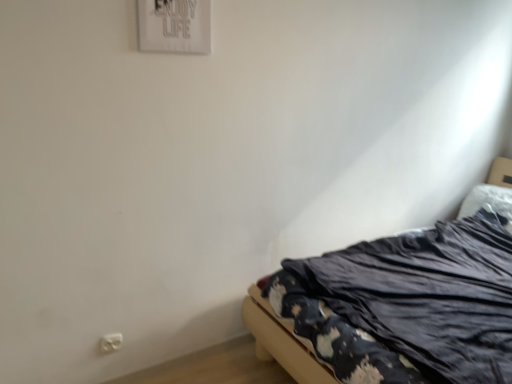
Question: From the image's perspective, is white plastic electric outlet at lower left located beneath dark fabric bed at lower right?

Choices:
 (A) yes
 (B) no

Answer: (A)

Question: Is white plastic electric outlet at lower left placed right next to dark fabric bed at lower right?

Choices:
 (A) no
 (B) yes

Answer: (A)

Question: Does white plastic electric outlet at lower left have a larger size compared to dark fabric bed at lower right?

Choices:
 (A) yes
 (B) no

Answer: (B)

Question: Does white plastic electric outlet at lower left have a greater width compared to dark fabric bed at lower right?

Choices:
 (A) no
 (B) yes

Answer: (A)

Question: Is white plastic electric outlet at lower left facing towards dark fabric bed at lower right?

Choices:
 (A) yes
 (B) no

Answer: (B)

Question: From a real-world perspective, is white plastic electric outlet at lower left on top of dark fabric bed at lower right?

Choices:
 (A) yes
 (B) no

Answer: (B)

Question: Is dark fabric bed at lower right positioned far away from white plastic electric outlet at lower left?

Choices:
 (A) yes
 (B) no

Answer: (A)

Question: Can you confirm if dark fabric bed at lower right is bigger than white plastic electric outlet at lower left?

Choices:
 (A) yes
 (B) no

Answer: (A)

Question: From the image's perspective, would you say dark fabric bed at lower right is shown under white plastic electric outlet at lower left?

Choices:
 (A) no
 (B) yes

Answer: (A)

Question: Can you confirm if dark fabric bed at lower right is positioned to the left of white plastic electric outlet at lower left?

Choices:
 (A) yes
 (B) no

Answer: (B)

Question: Is dark fabric bed at lower right wider than white plastic electric outlet at lower left?

Choices:
 (A) yes
 (B) no

Answer: (A)

Question: Could white plastic electric outlet at lower left be considered to be inside dark fabric bed at lower right?

Choices:
 (A) yes
 (B) no

Answer: (B)

Question: Considering the relative positions of white plastic electric outlet at lower left and dark fabric bed at lower right in the image provided, is white plastic electric outlet at lower left to the left or to the right of dark fabric bed at lower right?

Choices:
 (A) right
 (B) left

Answer: (B)